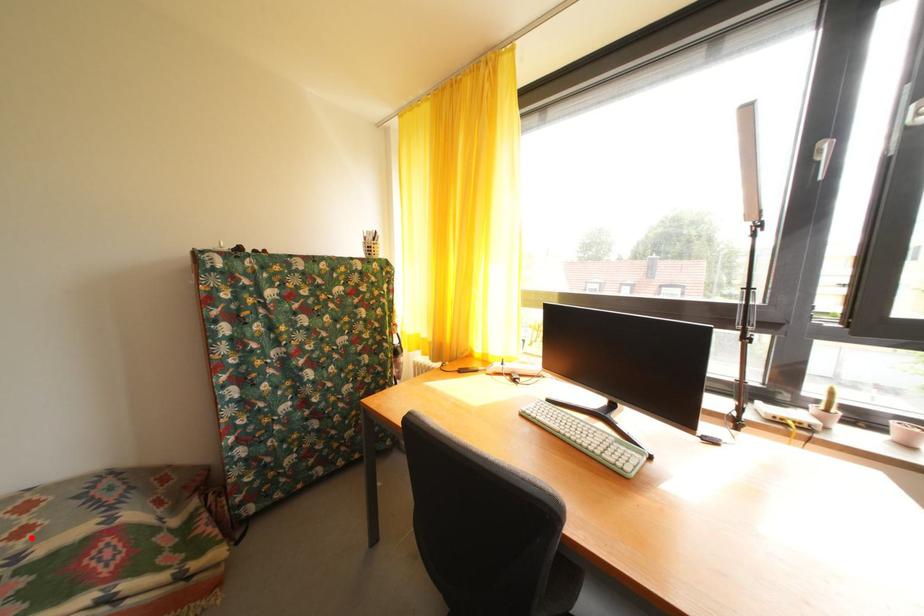
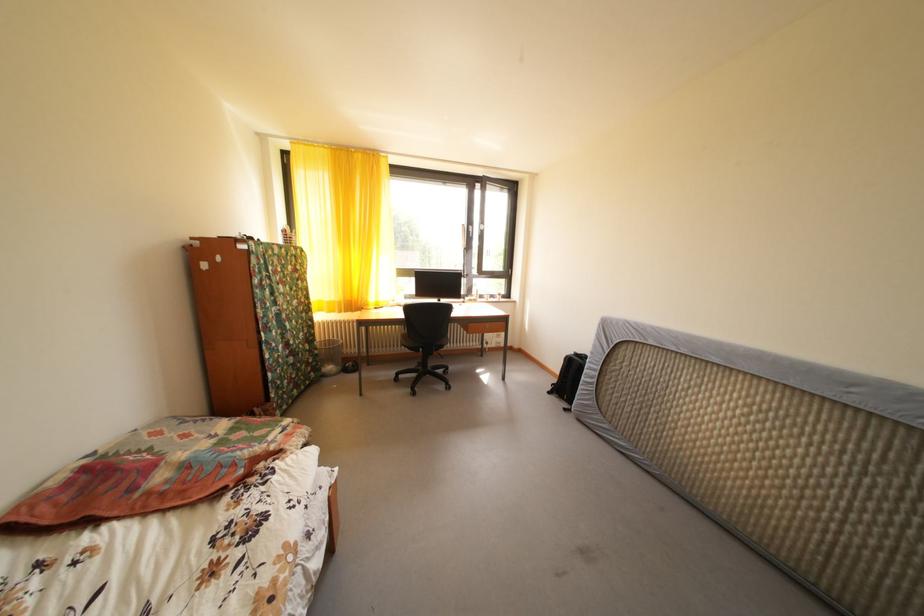
Where in the second image is the point corresponding to the highlighted location from the first image?

(195, 442)